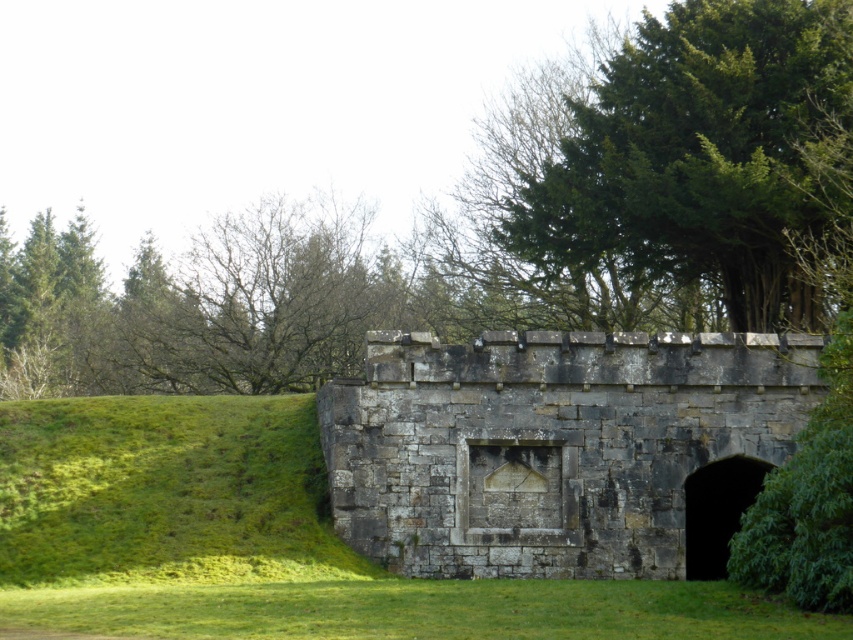
Consider the image. You are standing in front of the gray stone bunker at center and want to take shelter from the rain. The green leafy tree at upper right is nearby. Which direction should you move to stay under the tree for cover?

Result: The gray stone bunker at center is positioned under the green leafy tree at upper right, so moving towards the tree at upper right would place you under its cover.

Looking at this image, you are a hiker who wants to take a photo of the gray stone bunker at center and the green leafy tree at upper right. From your current position, which object is closer to you?

The gray stone bunker at center is closer to you because it is in front of the green leafy tree at upper right.